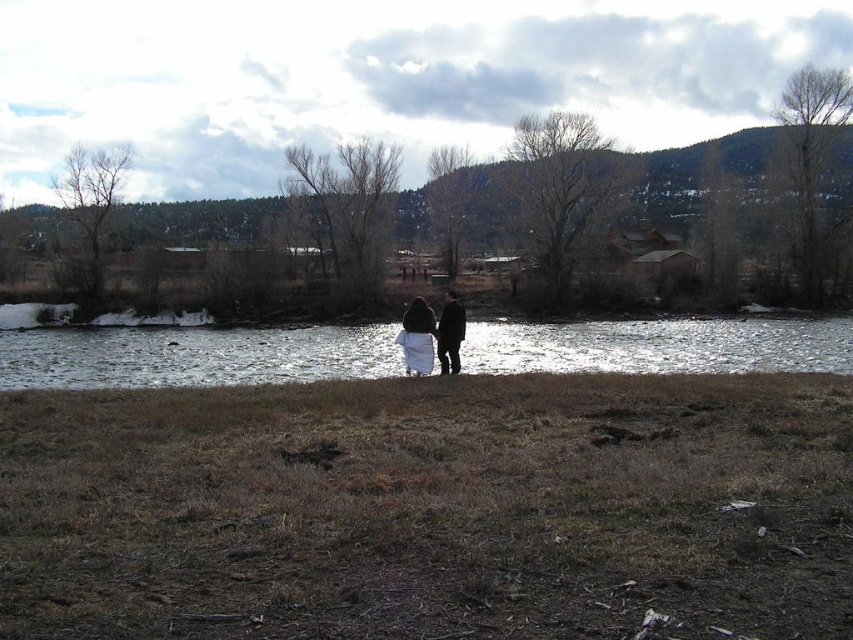
Based on the photo, you are a photographer setting up a shoot near the riverbank. You have two coats to position for the scene. The white wool coat at center and the black matte coat at center are both placed in the foreground. Which coat should you adjust to ensure it doesn not block the view of the river? Explain your choice based on their sizes.

The white wool coat at center is not as tall as the black matte coat at center. Since the black matte coat at center is taller, it is more likely to block the view of the river. Therefore, you should adjust the position of the black matte coat at center to ensure it does not obstruct the river view.

You are a hiker trying to cross the river using the path between the reflective silver water at center and the black matte coat at center. Given that the path is only wide enough for one person at a time, can you safely pass through without getting too close to either object?

The reflective silver water at center is wider than the black matte coat at center. Since the path between them is only wide enough for one person, you can safely pass through as long as you stay centered between both objects to maintain a safe distance from either side.

You are a hiker who needs to cross the river to reach the trees on the other side. You have a white wool coat at center. Can you safely step onto the reflective silver water at center from the coat? Explain why or why not using the distance provided.

The reflective silver water at center is 57.47 feet away from the white wool coat at center. This distance is too large to safely jump or step across, so you cannot safely cross directly from the coat to the water.